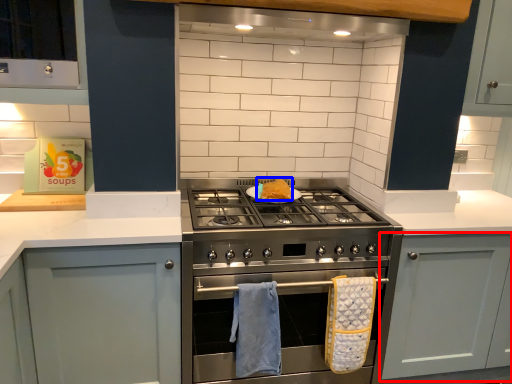
Question: Which point is further to the camera, cabinetry (highlighted by a red box) or food (highlighted by a blue box)?

Choices:
 (A) cabinetry
 (B) food

Answer: (B)